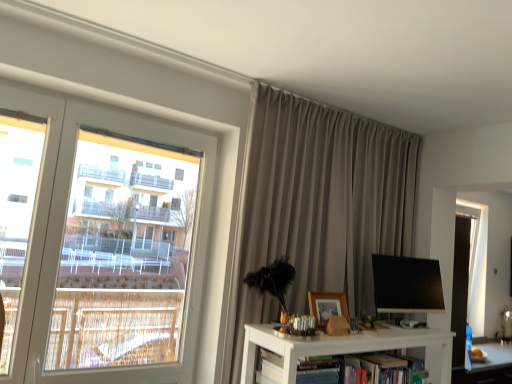
Where is `free space above matte gray curtain at upper center (from a real-world perspective)`? Image resolution: width=512 pixels, height=384 pixels. free space above matte gray curtain at upper center (from a real-world perspective) is located at coordinates (344, 111).